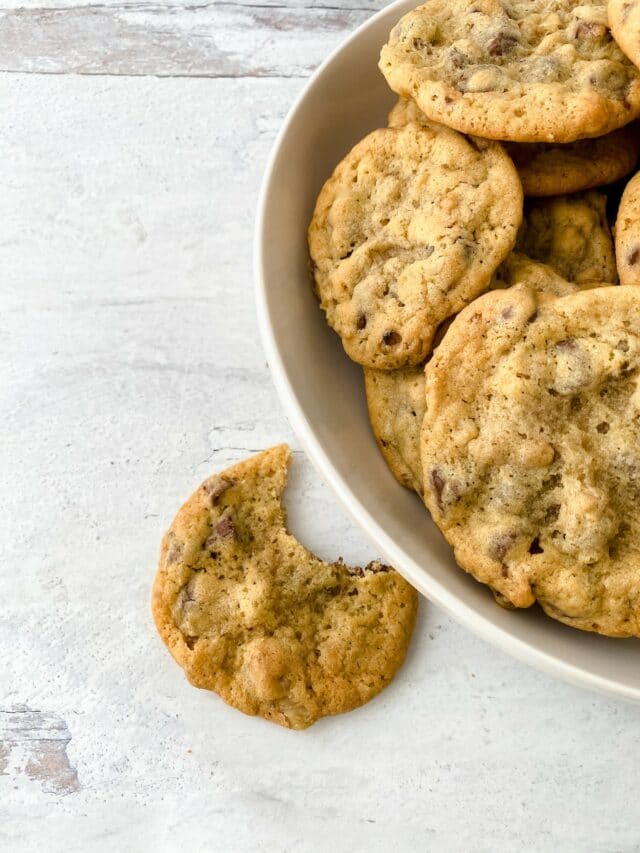
Where is `bowl`? Image resolution: width=640 pixels, height=853 pixels. bowl is located at coordinates (308, 345).